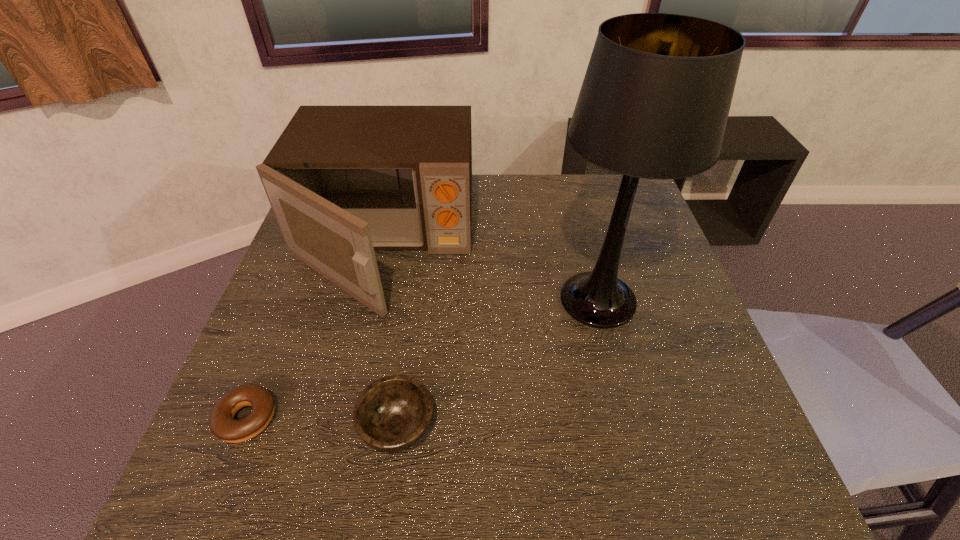
This screenshot has width=960, height=540. Find the location of `table lamp`. table lamp is located at coordinates coord(654,103).

Where is `the rightmost object`? The image size is (960, 540). the rightmost object is located at coordinates (654, 103).

The height and width of the screenshot is (540, 960). I want to click on the second tallest object, so click(x=343, y=181).

The width and height of the screenshot is (960, 540). I want to click on bowl, so click(x=393, y=413).

Locate an element on the screen. The height and width of the screenshot is (540, 960). the shortest object is located at coordinates (222, 424).

Where is `blank space located 0.210m on the front of the rightmost object`? This screenshot has height=540, width=960. blank space located 0.210m on the front of the rightmost object is located at coordinates (632, 435).

The width and height of the screenshot is (960, 540). In order to click on free space located 0.230m with the door open on the front of the microwave oven in this screenshot , I will do `click(343, 416)`.

Where is `free space located on the back of the second shortest object`? This screenshot has height=540, width=960. free space located on the back of the second shortest object is located at coordinates (417, 288).

Locate an element on the screen. free space located 0.110m on the back of the doughnut is located at coordinates (276, 347).

Locate an element on the screen. This screenshot has height=540, width=960. object positioned at the far edge is located at coordinates (343, 181).